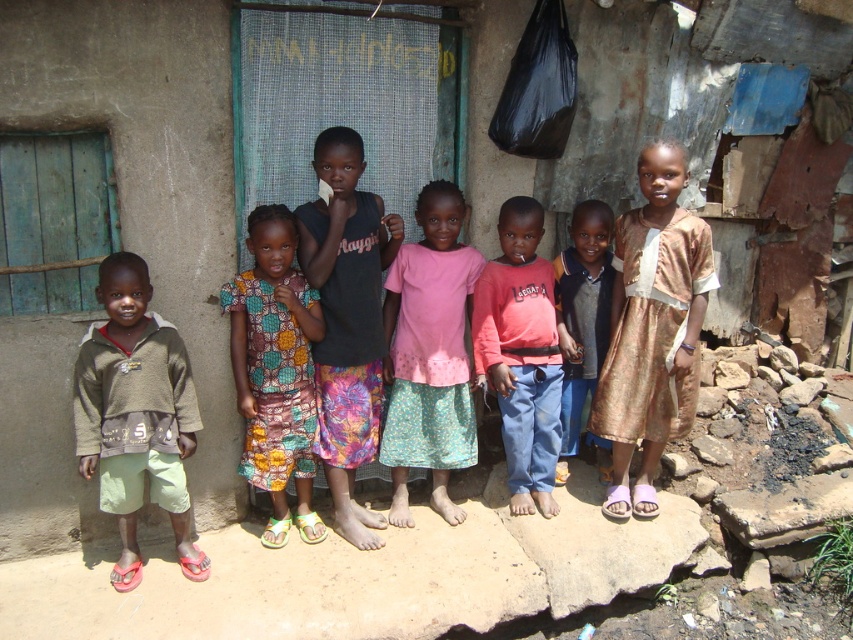
Looking at this image, you are a photographer trying to capture a group photo of the children. You want to ensure that both the green cotton shorts at left and the pink fabric dress at center are in focus. Given that your camera can only focus on objects within a 5 feet range, will you be able to capture both in focus?

The green cotton shorts at left and pink fabric dress at center are 6.67 feet apart, which exceeds the camera focus range of 5 feet. Therefore, you cannot capture both in focus simultaneously.

You are a photographer trying to capture a photo of the children in the scene. You notice the printed fabric dress at center and the matte pink shirt at center. Which clothing item is positioned lower on the child wearing them?

The printed fabric dress at center is positioned lower than the matte pink shirt at center, so it is the one that is lower on the child wearing them.